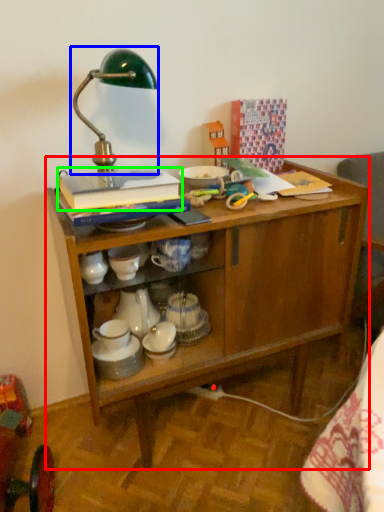
Question: Based on their relative distances, which object is farther from desk (highlighted by a red box)? Choose from table lamp (highlighted by a blue box) and book (highlighted by a green box).

Choices:
 (A) table lamp
 (B) book

Answer: (A)